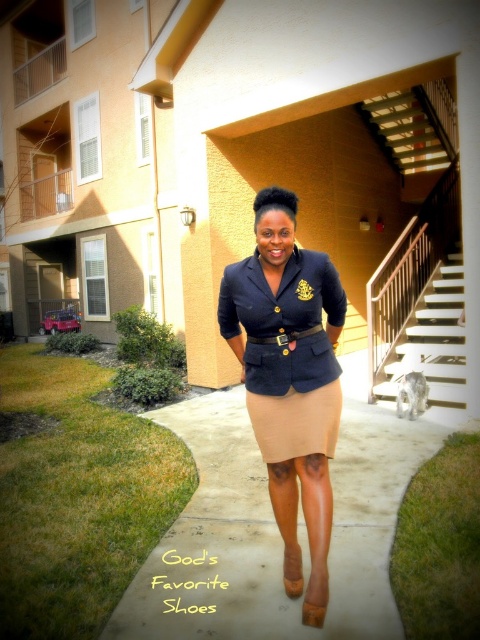
Who is more distant from viewer, (450, 312) or (302, 419)?

Positioned behind is point (450, 312).

Is point (444, 346) more distant than point (311, 392)?

Yes, it is behind point (311, 392).

Which is behind, point (462, 344) or point (288, 442)?

Point (462, 344)

The width and height of the screenshot is (480, 640). I want to click on white wooden stairs at right, so click(x=433, y=340).

Can you confirm if suede skirt at center is positioned to the left of beige satin skirt at center?

Correct, you'll find suede skirt at center to the left of beige satin skirt at center.

Is suede skirt at center further to camera compared to beige satin skirt at center?

No, it is not.

Does point (226, 324) come in front of point (304, 419)?

That is False.

Locate an element on the screen. The height and width of the screenshot is (640, 480). suede skirt at center is located at coordinates (287, 352).

Is beige concrete pavement at center wider than white wooden stairs at right?

Indeed, beige concrete pavement at center has a greater width compared to white wooden stairs at right.

Does beige concrete pavement at center lie in front of white wooden stairs at right?

Yes, beige concrete pavement at center is in front of white wooden stairs at right.

Which is behind, point (354, 604) or point (389, 381)?

Point (389, 381)

This screenshot has width=480, height=640. In order to click on beige concrete pavement at center in this screenshot , I will do `click(276, 525)`.